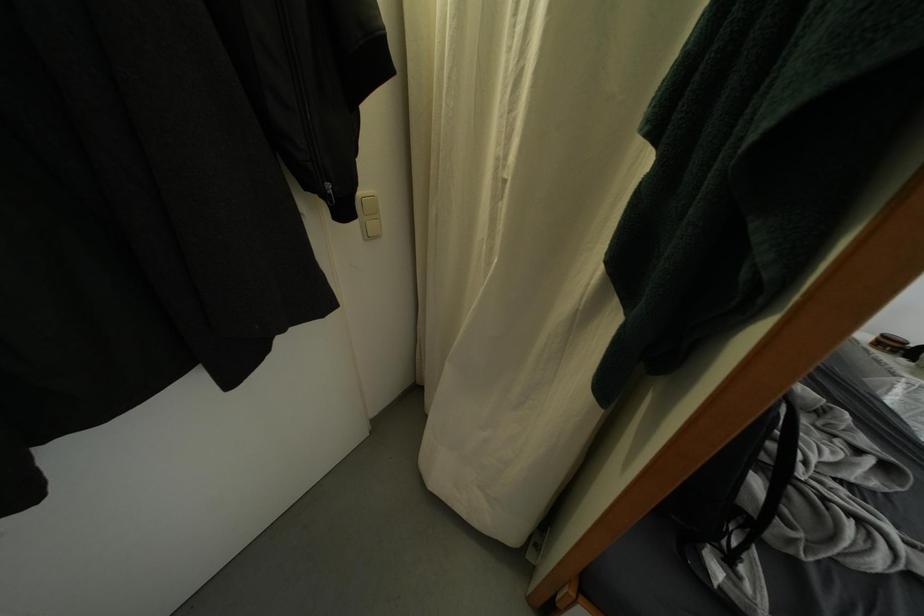
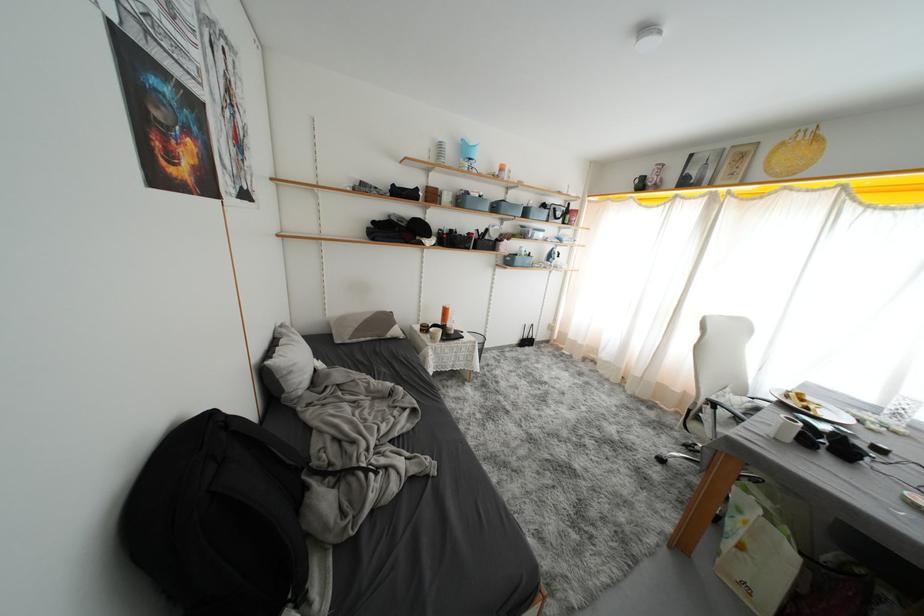
Question: The camera is either moving clockwise (left) or counter-clockwise (right) around the object. The first image is from the beginning of the video and the second image is from the end. Is the camera moving left or right when shooting the video?

Choices:
 (A) Left
 (B) Right

Answer: (A)